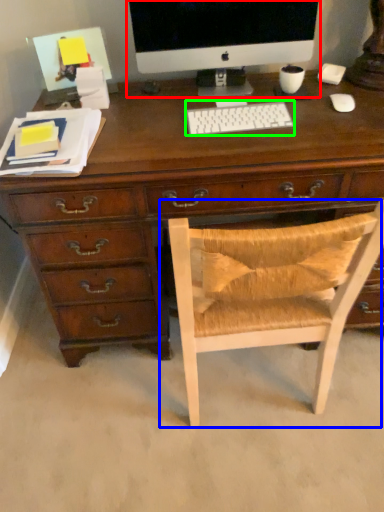
Question: Which object is the farthest from computer monitor (highlighted by a red box)? Choose among these: chair (highlighted by a blue box) or computer keyboard (highlighted by a green box).

Choices:
 (A) chair
 (B) computer keyboard

Answer: (A)